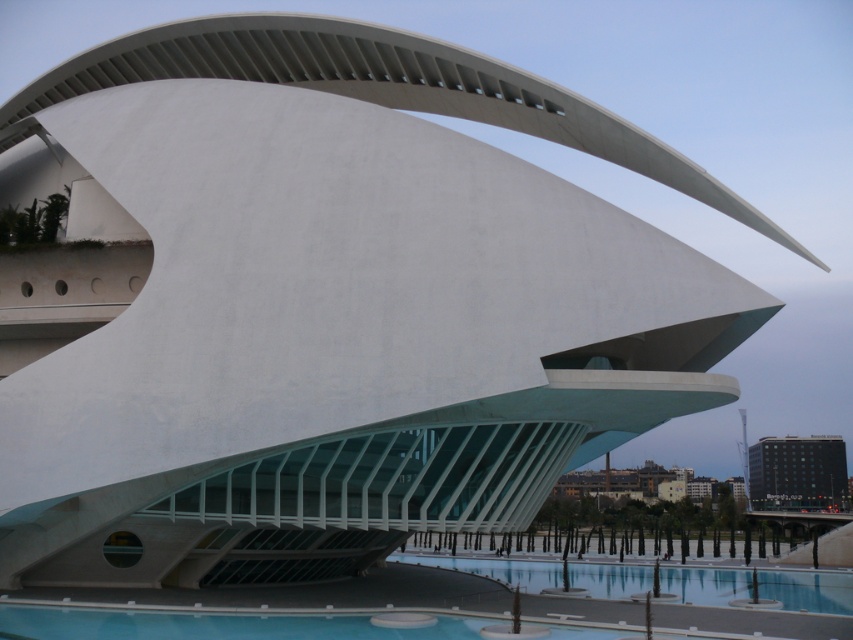
Question: Can you confirm if transparent glass pool at lower center is wider than black glass building at lower right?

Choices:
 (A) yes
 (B) no

Answer: (A)

Question: Is transparent glass pool at lower center thinner than black glass building at lower right?

Choices:
 (A) yes
 (B) no

Answer: (B)

Question: Which point appears closest to the camera in this image?

Choices:
 (A) (804, 486)
 (B) (622, 579)

Answer: (B)

Question: In this image, where is transparent glass pool at lower center located relative to black glass building at lower right?

Choices:
 (A) below
 (B) above

Answer: (B)